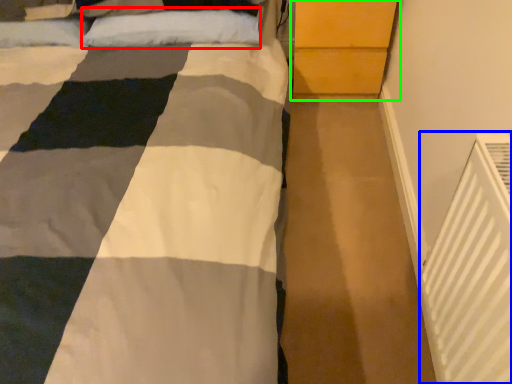
Question: Which object is positioned farthest from pillow (highlighted by a red box)? Select from air conditioning (highlighted by a blue box) and dresser (highlighted by a green box).

Choices:
 (A) air conditioning
 (B) dresser

Answer: (A)